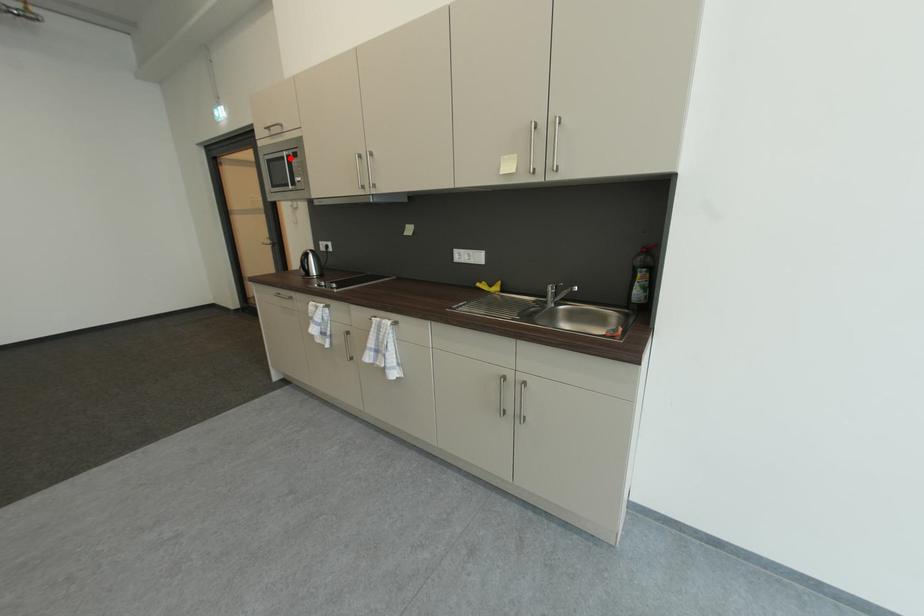
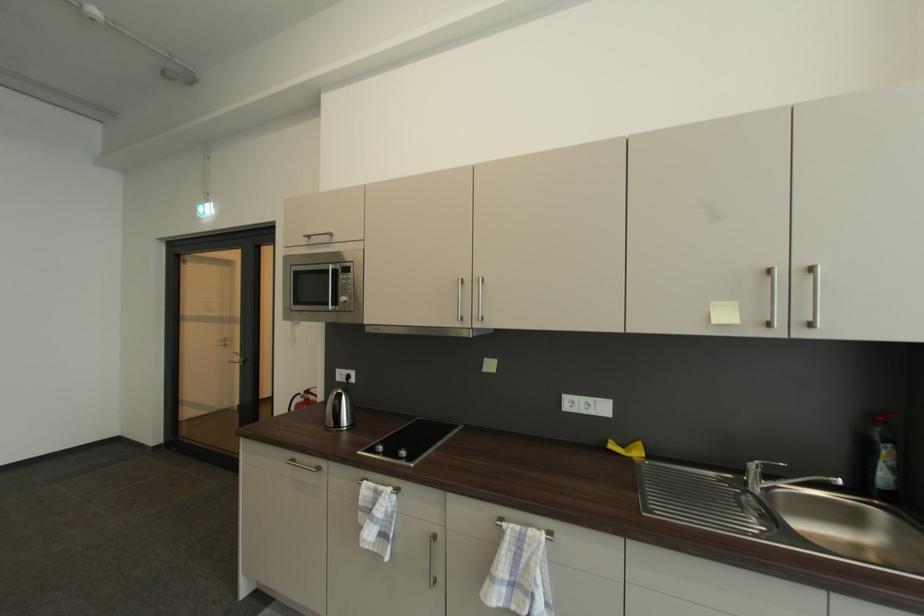
Where in the second image is the point corresponding to the highlighted location from the first image?

(334, 272)